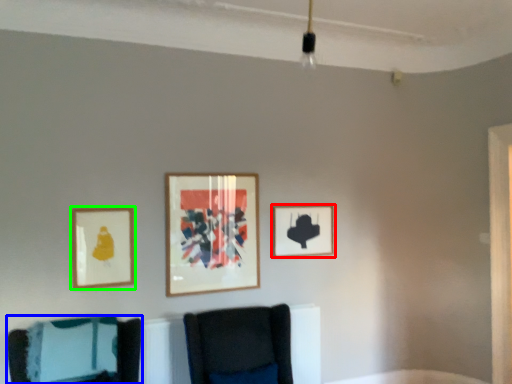
Question: Which object is the farthest from picture frame (highlighted by a red box)? Choose among these: furniture (highlighted by a blue box) or picture frame (highlighted by a green box).

Choices:
 (A) furniture
 (B) picture frame

Answer: (A)